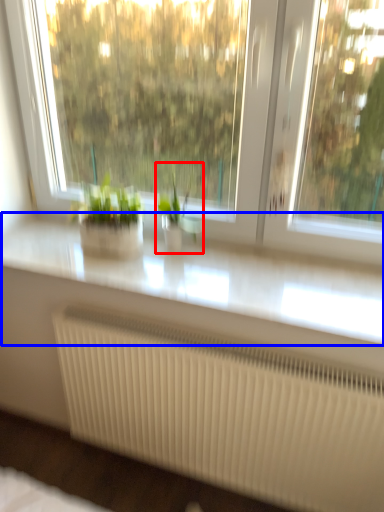
Question: Among these objects, which one is nearest to the camera, houseplant (highlighted by a red box) or counter top (highlighted by a blue box)?

Choices:
 (A) houseplant
 (B) counter top

Answer: (B)